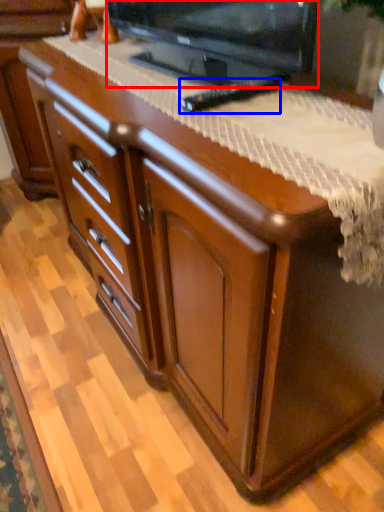
Question: Which of the following is the closest to the observer, television (highlighted by a red box) or remote (highlighted by a blue box)?

Choices:
 (A) television
 (B) remote

Answer: (A)